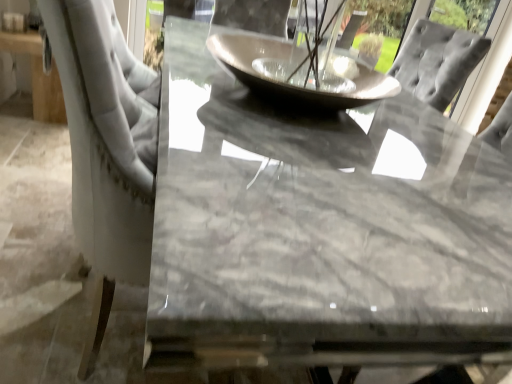
Question: Is matte gray glass bowl at center positioned beyond the bounds of marble table at center?

Choices:
 (A) no
 (B) yes

Answer: (B)

Question: Is marble table at center at the back of matte gray glass bowl at center?

Choices:
 (A) no
 (B) yes

Answer: (A)

Question: Is matte gray glass bowl at center wider than marble table at center?

Choices:
 (A) no
 (B) yes

Answer: (A)

Question: From the image's perspective, is matte gray glass bowl at center on top of marble table at center?

Choices:
 (A) yes
 (B) no

Answer: (A)

Question: Does matte gray glass bowl at center have a lesser width compared to marble table at center?

Choices:
 (A) yes
 (B) no

Answer: (A)

Question: Does matte gray glass bowl at center come behind marble table at center?

Choices:
 (A) yes
 (B) no

Answer: (A)

Question: Does marble table at center have a smaller size compared to matte gray glass bowl at center?

Choices:
 (A) yes
 (B) no

Answer: (B)

Question: Is marble table at center touching matte gray glass bowl at center?

Choices:
 (A) yes
 (B) no

Answer: (B)

Question: Is marble table at center positioned behind matte gray glass bowl at center?

Choices:
 (A) no
 (B) yes

Answer: (A)

Question: Is marble table at center facing away from matte gray glass bowl at center?

Choices:
 (A) no
 (B) yes

Answer: (A)

Question: Could you tell me if marble table at center is facing matte gray glass bowl at center?

Choices:
 (A) no
 (B) yes

Answer: (A)

Question: Is marble table at center outside of matte gray glass bowl at center?

Choices:
 (A) no
 (B) yes

Answer: (B)

Question: Relative to marble table at center, is matte gray glass bowl at center in front or behind?

Choices:
 (A) behind
 (B) front

Answer: (A)